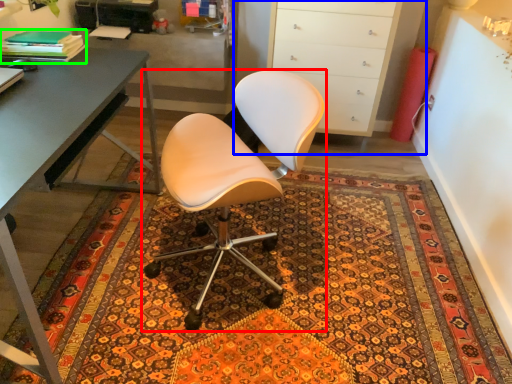
Question: Considering the real-world distances, which object is closest to chair (highlighted by a red box)? cabinetry (highlighted by a blue box) or book (highlighted by a green box).

Choices:
 (A) cabinetry
 (B) book

Answer: (B)